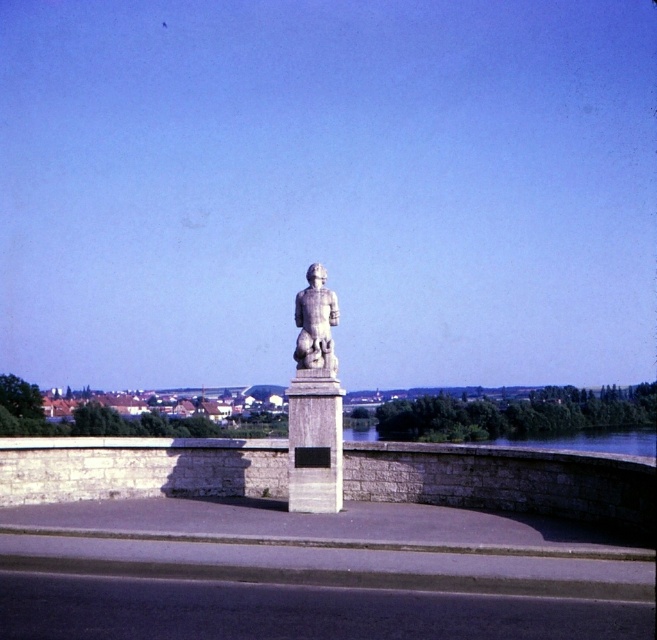
Which of these two, white stone statue at center or stone statue at center, stands taller?

Standing taller between the two is white stone statue at center.

Does white stone statue at center appear under stone statue at center?

Yes.

Locate an element on the screen. The width and height of the screenshot is (657, 640). white stone statue at center is located at coordinates (313, 403).

Find the location of a particular element. The image size is (657, 640). white stone statue at center is located at coordinates (313, 403).